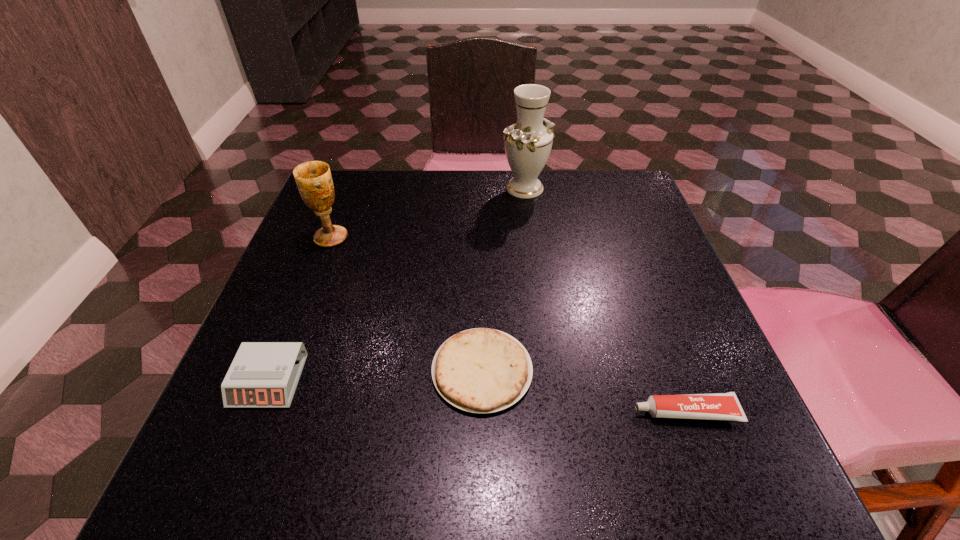
This screenshot has height=540, width=960. I want to click on free space at the near edge, so (x=329, y=436).

What are the coordinates of `free space at the left edge of the desktop` in the screenshot? It's located at coord(343,284).

This screenshot has height=540, width=960. In the image, there is a desktop. What are the coordinates of `vacant space at the right edge` in the screenshot? It's located at (696, 342).

Image resolution: width=960 pixels, height=540 pixels. In the image, there is a desktop. Find the location of `vacant area at the far left corner`. vacant area at the far left corner is located at coordinates (336, 210).

Where is `vacant space at the far right corner of the desktop`? vacant space at the far right corner of the desktop is located at coordinates (613, 170).

Where is `free region at the near right corner of the desktop`? The image size is (960, 540). free region at the near right corner of the desktop is located at coordinates (692, 470).

The width and height of the screenshot is (960, 540). Find the location of `free space between the alarm clock and the second farthest object`. free space between the alarm clock and the second farthest object is located at coordinates (300, 309).

Find the location of a particular element. The height and width of the screenshot is (540, 960). vacant area that lies between the rightmost object and the vase is located at coordinates (605, 300).

This screenshot has height=540, width=960. What are the coordinates of `vacant area that lies between the chalice and the third shortest object` in the screenshot? It's located at (300, 309).

The height and width of the screenshot is (540, 960). In order to click on empty space that is in between the rightmost object and the vase in this screenshot , I will do `click(605, 300)`.